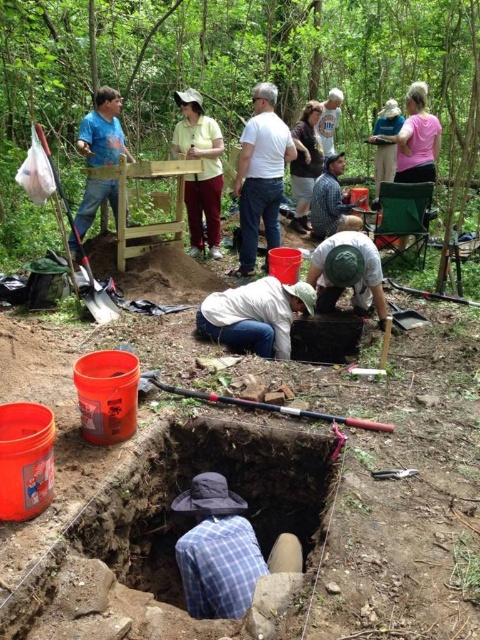
Who is more forward, [117,188] or [288,412]?

Point [288,412] is in front.

Who is more distant from viewer, [81,129] or [363,424]?

The point [81,129] is behind.

Locate an element on the screen. blue shirt at upper left is located at coordinates (103, 131).

Does white matte shirt at center appear on the right side of checkered fabric shirt at center?

Incorrect, white matte shirt at center is not on the right side of checkered fabric shirt at center.

Describe the element at coordinates (255, 316) in the screenshot. I see `white matte shirt at center` at that location.

Is point (314, 298) closer to viewer compared to point (334, 216)?

Yes, it is in front of point (334, 216).

You are a GUI agent. You are given a task and a screenshot of the screen. Output one action in this format:
    pyautogui.click(x=<x>, y=<y>)
    Task: Click on the white matte shirt at center
    
    Given the screenshot: What is the action you would take?
    pyautogui.click(x=255, y=316)

Between matte yellow shirt at center and blue shirt at upper left, which one is positioned lower?

blue shirt at upper left

Does matte yellow shirt at center appear on the right side of blue shirt at upper left?

Correct, you'll find matte yellow shirt at center to the right of blue shirt at upper left.

Identify the location of matte yellow shirt at center. (201, 172).

Find the location of a particular element. The width and height of the screenshot is (480, 640). matte yellow shirt at center is located at coordinates (201, 172).